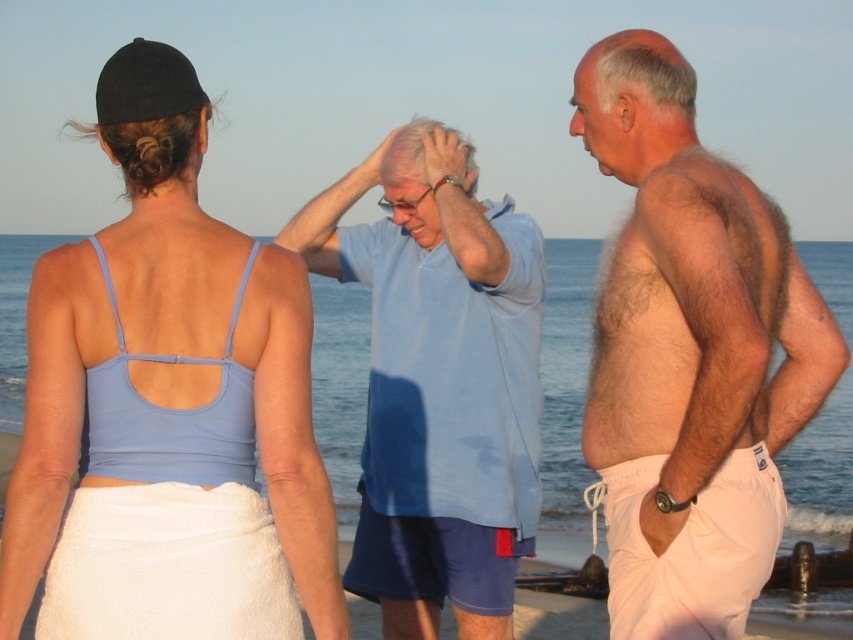
Question: Which point is closer to the camera?

Choices:
 (A) matte blue tank top at center
 (B) beige cotton shorts at right

Answer: (A)

Question: Is beige cotton shorts at right smaller than light blue cotton shirt at center?

Choices:
 (A) yes
 (B) no

Answer: (B)

Question: Based on their relative distances, which object is nearer to the matte blue tank top at center?

Choices:
 (A) beige cotton shorts at right
 (B) light blue cotton shirt at center

Answer: (B)

Question: Among these objects, which one is farthest from the camera?

Choices:
 (A) matte blue tank top at center
 (B) light blue cotton shirt at center

Answer: (B)

Question: Can you confirm if matte blue tank top at center is bigger than light blue cotton shirt at center?

Choices:
 (A) yes
 (B) no

Answer: (A)

Question: Does beige cotton shorts at right come behind light blue cotton shirt at center?

Choices:
 (A) no
 (B) yes

Answer: (A)